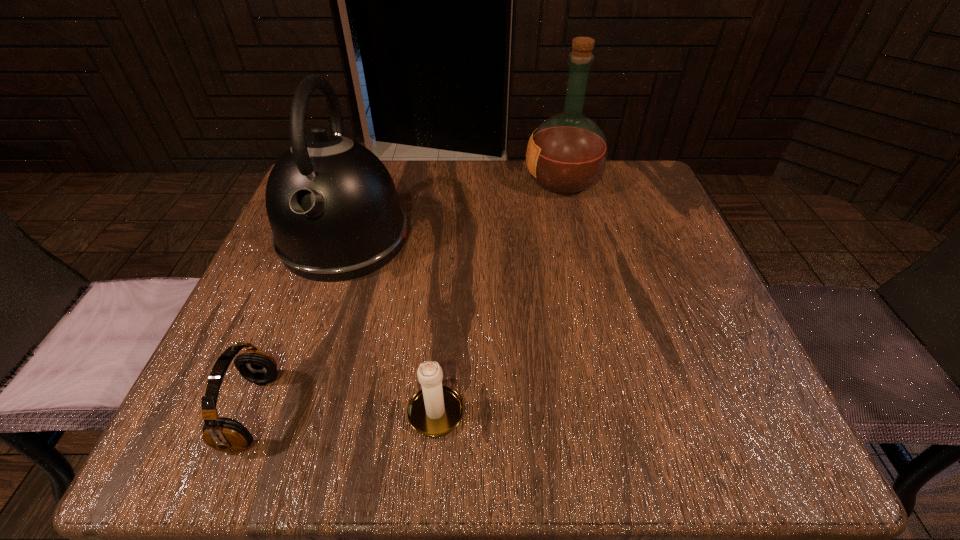
This screenshot has height=540, width=960. What are the coordinates of `vacant point located between the liquor and the headset` in the screenshot? It's located at (407, 296).

You are a GUI agent. You are given a task and a screenshot of the screen. Output one action in this format:
    pyautogui.click(x=<x>, y=<y>)
    Task: Click on the empty space between the rightmost object and the candle holder
    
    Given the screenshot: What is the action you would take?
    pyautogui.click(x=499, y=294)

Locate an element on the screen. free space between the headset and the candle holder is located at coordinates (344, 410).

This screenshot has height=540, width=960. Find the location of `empty location between the headset and the second object from right to left`. empty location between the headset and the second object from right to left is located at coordinates (344, 410).

Identify the location of vacant area that lies between the rightmost object and the headset. The image size is (960, 540). (407, 296).

Identify the location of vacant region between the kettle and the liquor. (453, 210).

This screenshot has height=540, width=960. In order to click on blank region between the liquor and the second object from right to left in this screenshot , I will do `click(499, 294)`.

Locate an element on the screen. The width and height of the screenshot is (960, 540). object that is the closest to the kettle is located at coordinates (223, 434).

Choose which object is the second nearest neighbor to the liquor. Please provide its 2D coordinates. Your answer should be formatted as a tuple, i.e. [(x, y)], where the tuple contains the x and y coordinates of a point satisfying the conditions above.

[(434, 411)]

The image size is (960, 540). Find the location of `vacant area that satisfies the following two spatial constraints: 1. on the spout of the kettle; 2. on the ear cups of the headset`. vacant area that satisfies the following two spatial constraints: 1. on the spout of the kettle; 2. on the ear cups of the headset is located at coordinates (286, 411).